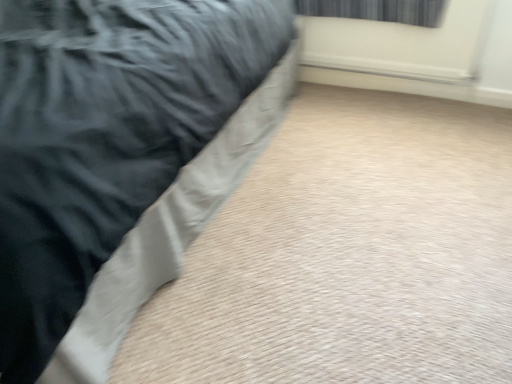
Question: Can you confirm if satin black bed at left is wider than dark gray fabric curtain at upper right?

Choices:
 (A) no
 (B) yes

Answer: (B)

Question: Is the position of satin black bed at left less distant than that of dark gray fabric curtain at upper right?

Choices:
 (A) no
 (B) yes

Answer: (B)

Question: Is satin black bed at left turned away from dark gray fabric curtain at upper right?

Choices:
 (A) yes
 (B) no

Answer: (B)

Question: Is satin black bed at left in contact with dark gray fabric curtain at upper right?

Choices:
 (A) yes
 (B) no

Answer: (B)

Question: From a real-world perspective, is satin black bed at left positioned over dark gray fabric curtain at upper right based on gravity?

Choices:
 (A) no
 (B) yes

Answer: (A)

Question: Does satin black bed at left have a greater height compared to dark gray fabric curtain at upper right?

Choices:
 (A) no
 (B) yes

Answer: (B)

Question: From a real-world perspective, is dark gray fabric curtain at upper right located higher than satin black bed at left?

Choices:
 (A) no
 (B) yes

Answer: (B)

Question: Is dark gray fabric curtain at upper right turned away from satin black bed at left?

Choices:
 (A) yes
 (B) no

Answer: (B)

Question: Can you confirm if dark gray fabric curtain at upper right is bigger than satin black bed at left?

Choices:
 (A) no
 (B) yes

Answer: (A)

Question: Can you confirm if dark gray fabric curtain at upper right is positioned to the right of satin black bed at left?

Choices:
 (A) no
 (B) yes

Answer: (B)

Question: Is dark gray fabric curtain at upper right not inside satin black bed at left?

Choices:
 (A) no
 (B) yes

Answer: (B)

Question: From the image's perspective, does dark gray fabric curtain at upper right appear higher than satin black bed at left?

Choices:
 (A) no
 (B) yes

Answer: (B)

Question: Considering the positions of satin black bed at left and dark gray fabric curtain at upper right in the image, is satin black bed at left taller or shorter than dark gray fabric curtain at upper right?

Choices:
 (A) tall
 (B) short

Answer: (A)